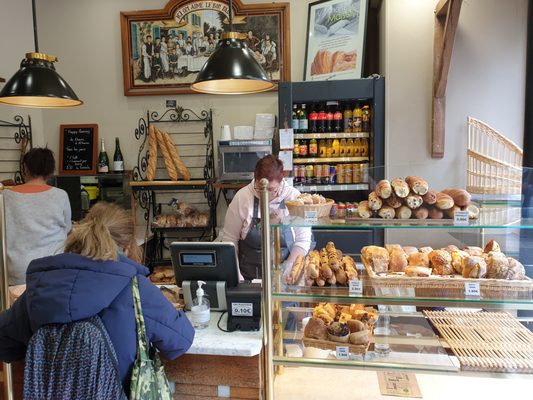
This screenshot has width=533, height=400. I want to click on lower shelf of beverage refrigerator, so click(346, 207).